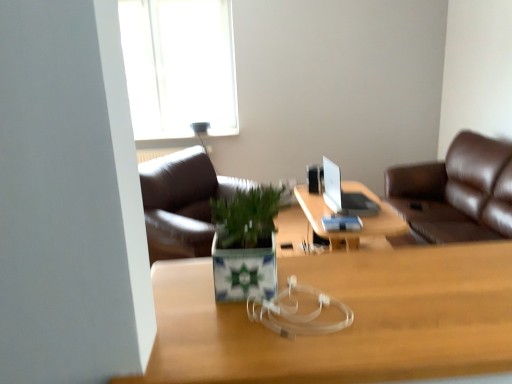
At what (x,y) coordinates should I click in order to perform the action: click on empty space that is ontop of wooden desk at center (from a real-world perspective). Please return your answer as a coordinate pair (x, y). The width and height of the screenshot is (512, 384). Looking at the image, I should click on (311, 292).